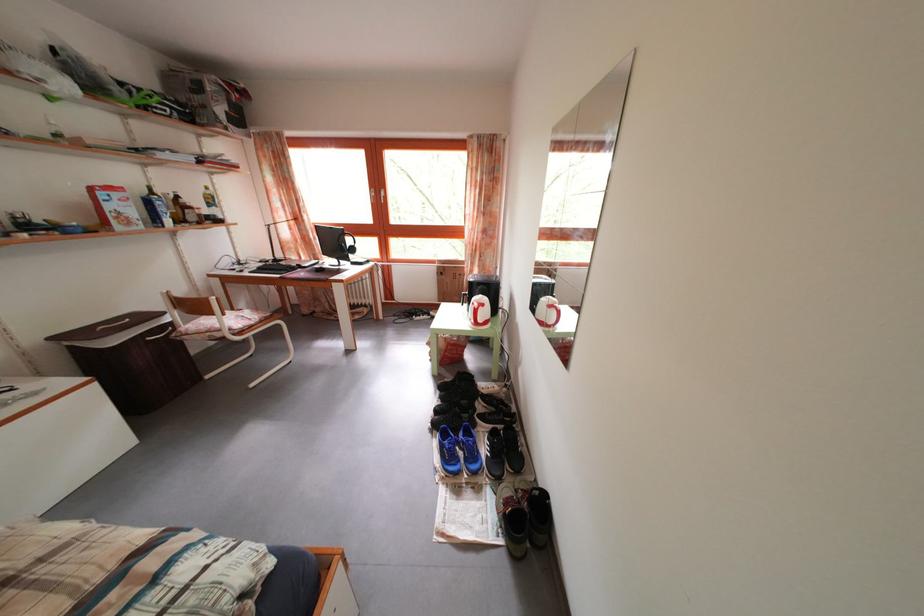
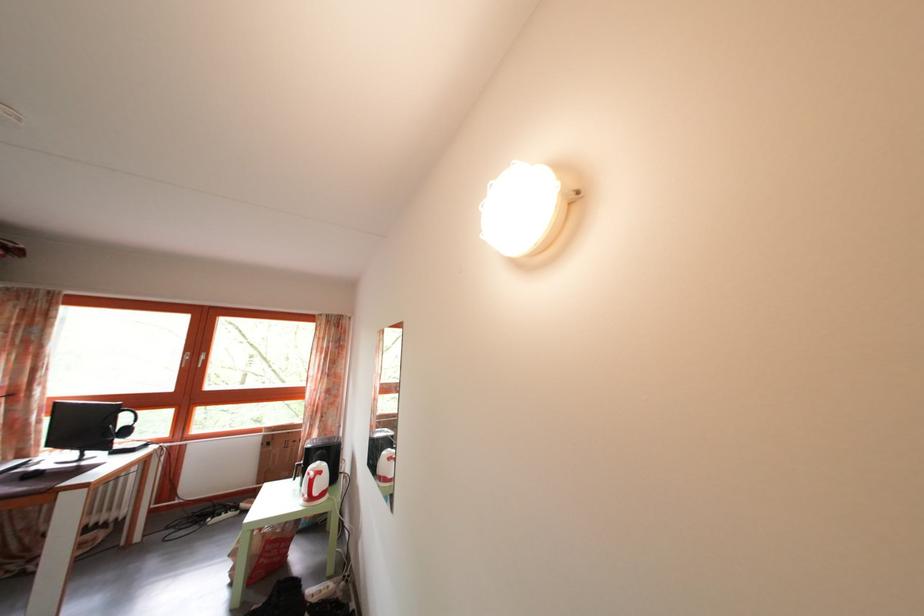
The point at (383, 200) is marked in the first image. Where is the corresponding point in the second image?

(199, 363)